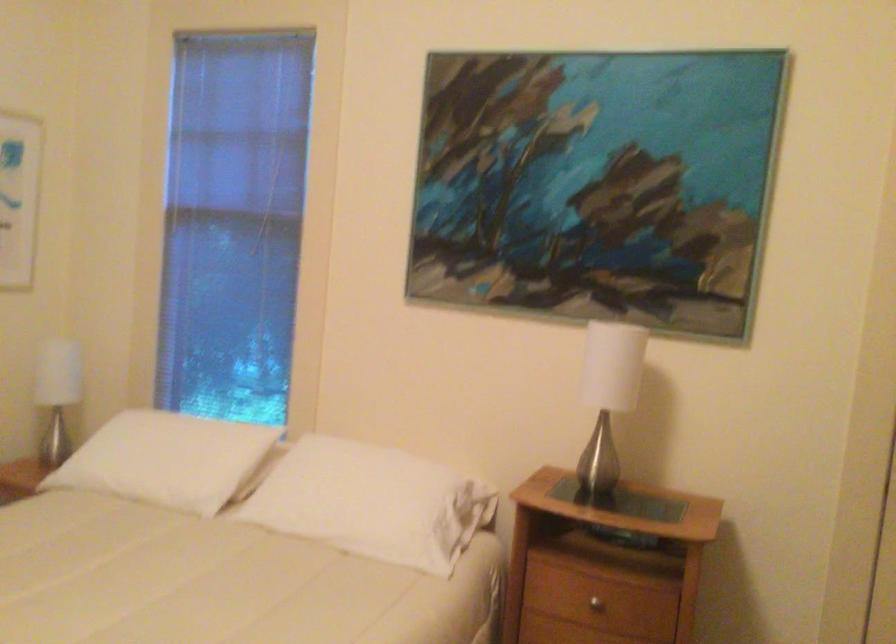
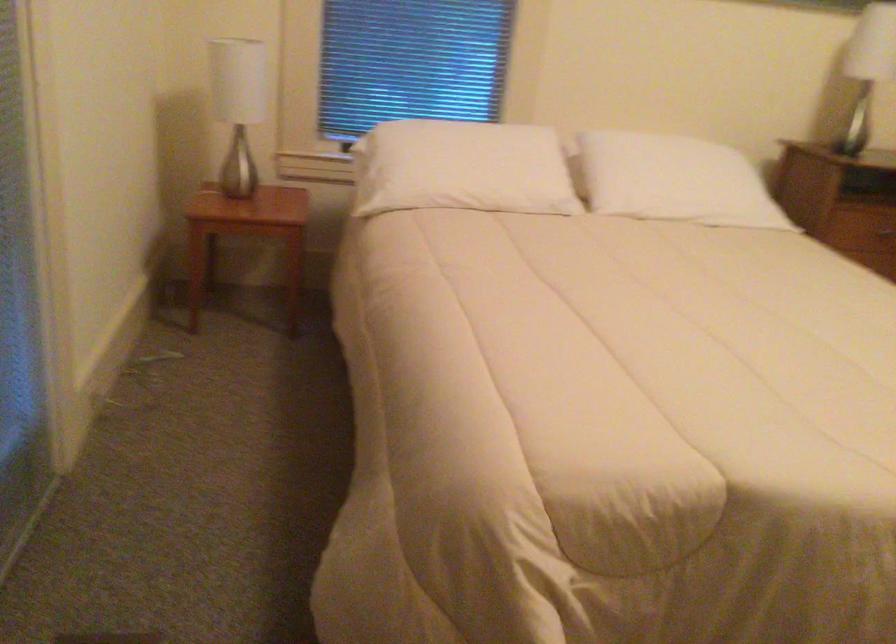
In the second image, find the point that corresponds to [126,458] in the first image.

(462, 167)